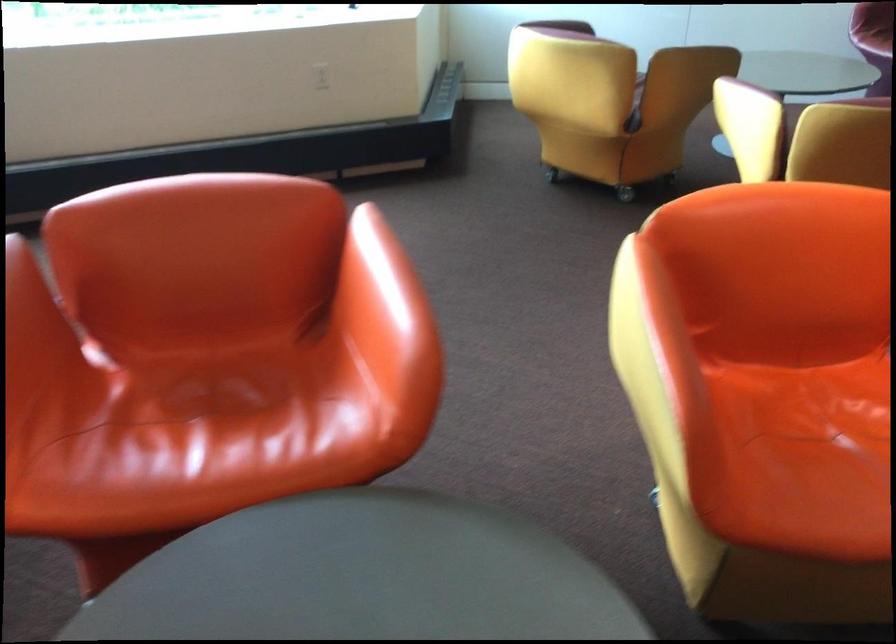
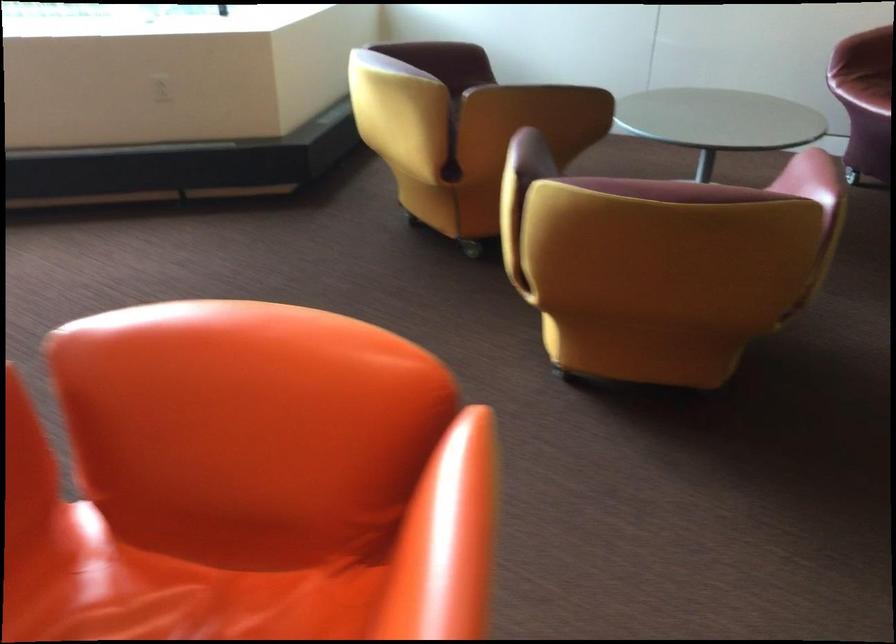
The images are taken continuously from a first-person perspective. In which direction are you moving?

The cameraman moved toward right, forward.